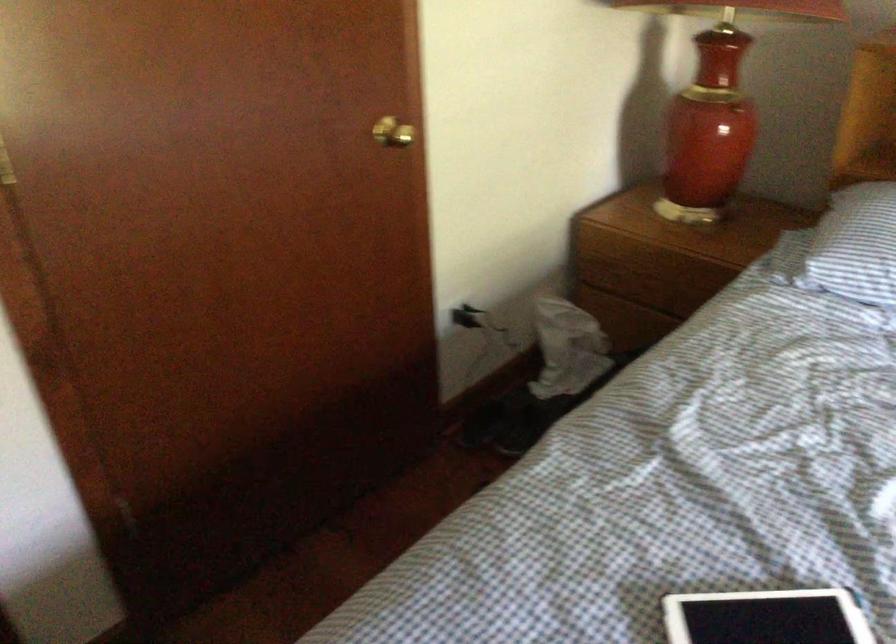
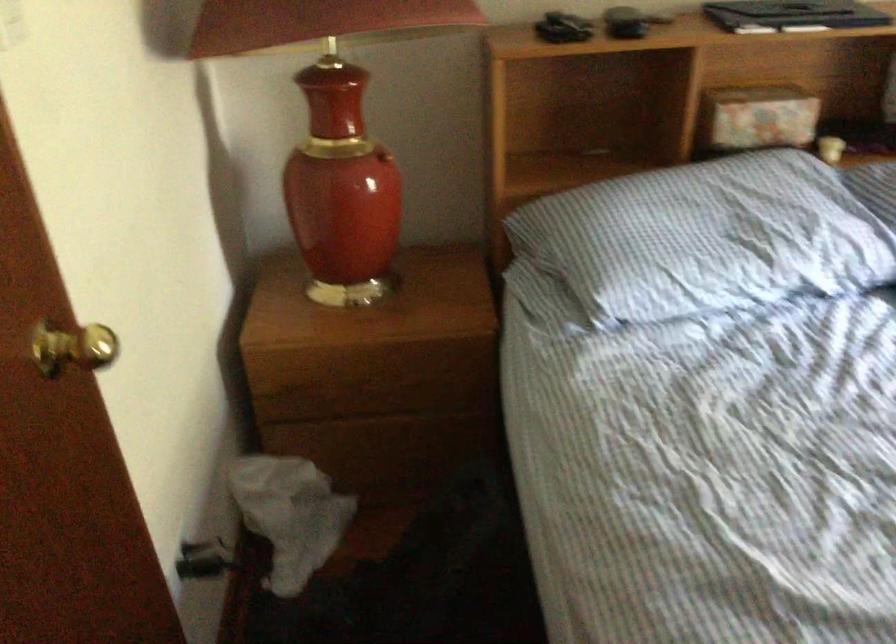
Find the pixel in the second image that matches point 563,343 in the first image.

(289, 515)